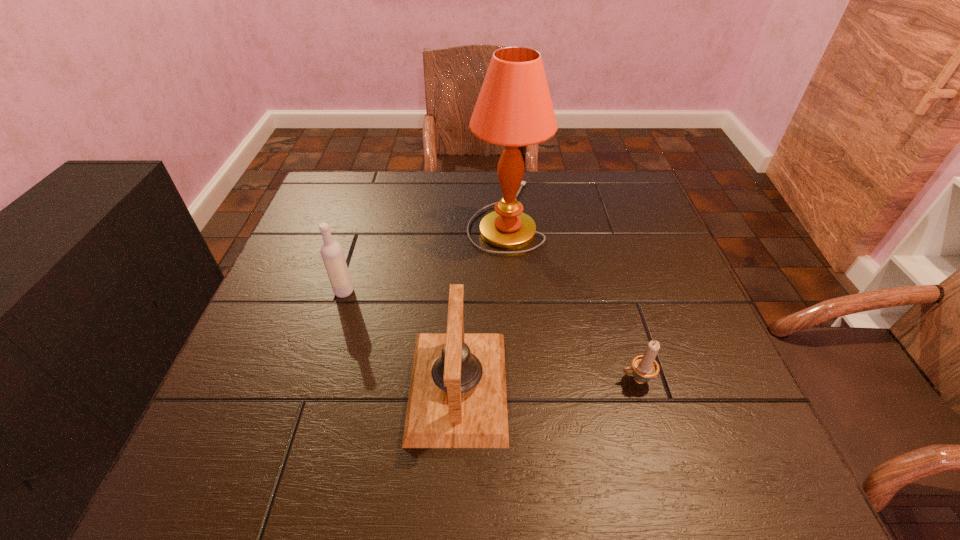
The image size is (960, 540). What are the coordinates of `unoccupied area between the tallest object and the candle_holder` in the screenshot? It's located at (570, 298).

Where is `empty space between the bell and the rightmost object`? empty space between the bell and the rightmost object is located at coordinates (547, 383).

Find the location of `empty location between the farthest object and the leftmost object`. empty location between the farthest object and the leftmost object is located at coordinates (424, 254).

Identify the location of object identified as the third closest to the lamp. The width and height of the screenshot is (960, 540). (645, 367).

Point out which object is positioned as the third nearest to the tallest object. Please provide its 2D coordinates. Your answer should be formatted as a tuple, i.e. [(x, y)], where the tuple contains the x and y coordinates of a point satisfying the conditions above.

[(645, 367)]

At what (x,y) coordinates should I click in order to perform the action: click on free location that satisfies the following two spatial constraints: 1. on the front side of the vodka; 2. on the left side of the bell. Please return your answer as a coordinate pair (x, y). The image size is (960, 540). Looking at the image, I should click on (315, 386).

The image size is (960, 540). What are the coordinates of `blank space that satisfies the following two spatial constraints: 1. on the front side of the bell; 2. on the left side of the third nearest object` in the screenshot? It's located at (315, 386).

This screenshot has height=540, width=960. In order to click on free location that satisfies the following two spatial constraints: 1. on the back side of the tallest object; 2. on the right side of the bell in this screenshot , I will do `click(465, 216)`.